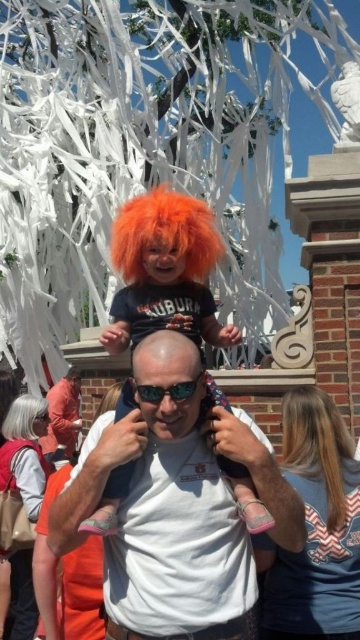
Question: Is white matte shirt at center further to camera compared to orange synthetic wig at upper center?

Choices:
 (A) no
 (B) yes

Answer: (A)

Question: Which of the following is the closest to the observer?

Choices:
 (A) bald head at center
 (B) orange synthetic wig at upper center
 (C) orange synthetic wig at center
 (D) orange wig at center

Answer: (D)

Question: Which point is closer to the camera taking this photo?

Choices:
 (A) (169, 218)
 (B) (29, 403)

Answer: (A)

Question: Estimate the real-world distances between objects in this image. Which object is farther from the orange wig at center?

Choices:
 (A) white matte shirt at center
 (B) orange synthetic wig at center
 (C) orange synthetic wig at upper center
 (D) bald head at center

Answer: (C)

Question: Where is orange wig at center located in relation to orange synthetic wig at center in the image?

Choices:
 (A) right
 (B) left

Answer: (A)

Question: Observing the image, what is the correct spatial positioning of orange wig at center in reference to orange synthetic wig at upper center?

Choices:
 (A) below
 (B) above

Answer: (B)